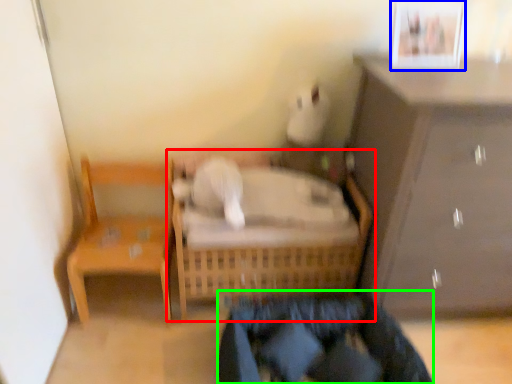
Question: Which object is the farthest from furniture (highlighted by a red box)? Choose among these: picture frame (highlighted by a blue box) or clothing (highlighted by a green box).

Choices:
 (A) picture frame
 (B) clothing

Answer: (A)